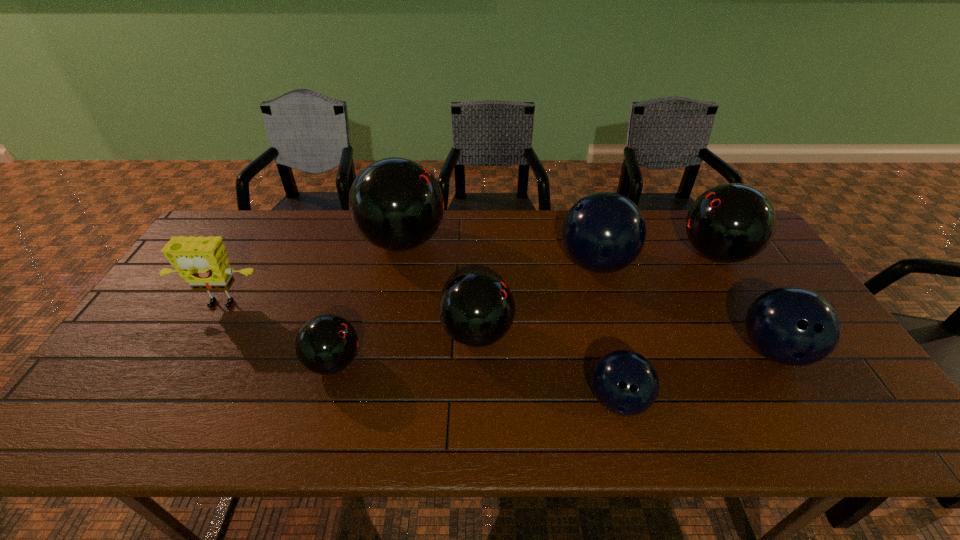
At what (x,y) coordinates should I click in order to perform the action: click on the smallest blue bowling ball. Please return your answer as a coordinate pair (x, y). Looking at the image, I should click on (624, 382).

You are a GUI agent. You are given a task and a screenshot of the screen. Output one action in this format:
    pyautogui.click(x=<x>, y=<y>)
    Task: Click on the vacant space situated 0.230m on the surface of the tallest bowling ball near the finger holes
    This screenshot has height=540, width=960.
    Given the screenshot: What is the action you would take?
    pyautogui.click(x=516, y=242)

You are a GUI agent. You are given a task and a screenshot of the screen. Output one action in this format:
    pyautogui.click(x=<x>, y=<y>)
    Task: Click on the free space located on the surface of the farthest blue bowling ball near the finger holes
    This screenshot has width=960, height=540.
    Given the screenshot: What is the action you would take?
    pyautogui.click(x=500, y=264)

You are a GUI agent. You are given a task and a screenshot of the screen. Output one action in this format:
    pyautogui.click(x=<x>, y=<y>)
    Task: Click on the vacant area situated 0.110m on the surface of the farthest blue bowling ball near the finger holes
    The height and width of the screenshot is (540, 960).
    Given the screenshot: What is the action you would take?
    pyautogui.click(x=522, y=264)

The height and width of the screenshot is (540, 960). I want to click on vacant area situated 0.050m on the surface of the farthest blue bowling ball near the finger holes, so click(541, 264).

Find the location of a particular element. The height and width of the screenshot is (540, 960). vacant position located 0.170m on the surface of the third smallest black bowling ball near the finger holes is located at coordinates (625, 254).

The image size is (960, 540). Find the location of `vacant region located on the surface of the third smallest black bowling ball near the finger holes`. vacant region located on the surface of the third smallest black bowling ball near the finger holes is located at coordinates (656, 254).

Where is `blank area located 0.360m on the surface of the third smallest black bowling ball near the finger holes`? Image resolution: width=960 pixels, height=540 pixels. blank area located 0.360m on the surface of the third smallest black bowling ball near the finger holes is located at coordinates (565, 254).

Find the location of a particular element. The height and width of the screenshot is (540, 960). free location located 0.230m on the front-facing side of the sponge is located at coordinates (170, 391).

Where is `free space located on the surface of the third black bowling ball from left to right near the finger holes`? The height and width of the screenshot is (540, 960). free space located on the surface of the third black bowling ball from left to right near the finger holes is located at coordinates (592, 334).